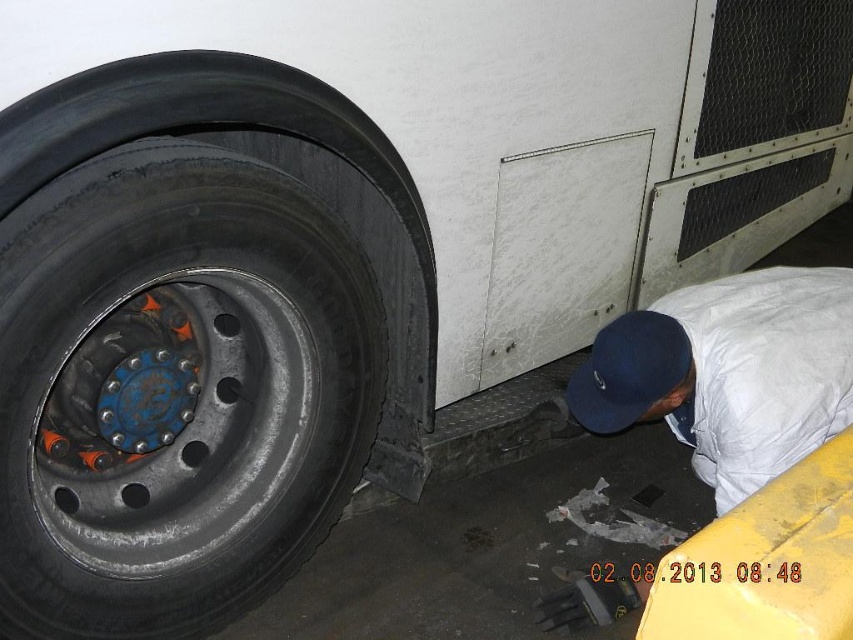
You are standing next to a large truck tire and see the blue metallic rim at lower left and the blue fabric baseball cap at lower right. Which object is positioned more to the left side?

The blue metallic rim at lower left is positioned more to the left than the blue fabric baseball cap at lower right.

You are standing next to a large truck tire and want to place a tool on the closest available surface. The blue metallic rim at lower left and the white fabric at lower right are both in sight. Which surface should you choose to ensure the tool stays in place?

The blue metallic rim at lower left is to the left of the white fabric at lower right, so the tool placed on the blue metallic rim at lower left would stay in place better due to its solid structure compared to the fabric.

You are a mechanic working on a truck. You need to place a tool that is 3 feet long between the blue metallic rim at lower left and the white fabric at lower right. Can you fit it there?

The distance between the blue metallic rim at lower left and the white fabric at lower right is 33.65 inches, which is approximately 2.8 feet. Since the tool is 3 feet long, it may not fit comfortably between them as the space is slightly smaller than the tool.